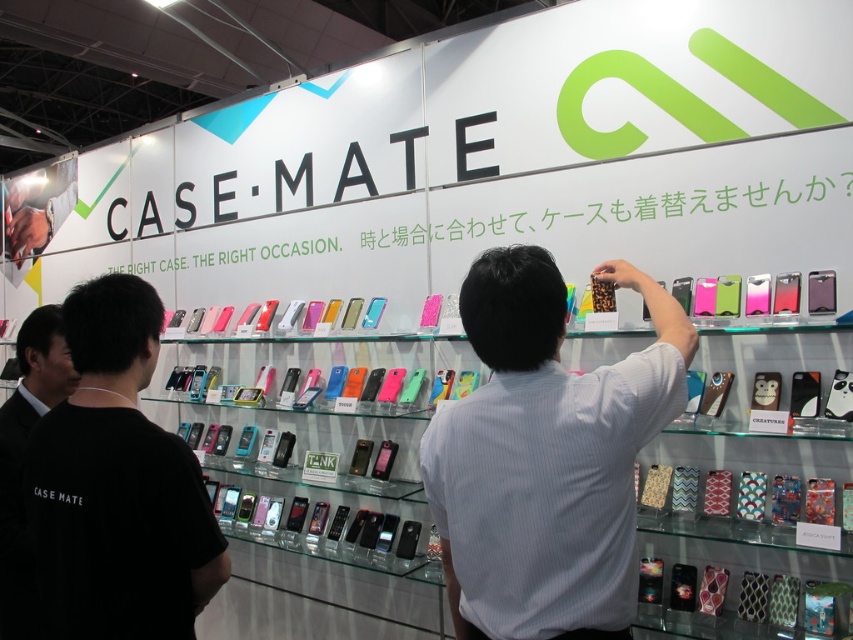
Question: Is leopard print case at upper center positioned in front of black shirt at left?

Choices:
 (A) yes
 (B) no

Answer: (A)

Question: Is black t-shirt at left smaller than black shirt at left?

Choices:
 (A) yes
 (B) no

Answer: (A)

Question: Which point is closer to the camera taking this photo?

Choices:
 (A) (148, 420)
 (B) (647, 371)
 (C) (3, 438)

Answer: (B)

Question: Among these points, which one is nearest to the camera?

Choices:
 (A) (22, 628)
 (B) (105, 344)

Answer: (B)

Question: Can you confirm if black t-shirt at left is positioned above black shirt at left?

Choices:
 (A) yes
 (B) no

Answer: (A)

Question: Among these objects, which one is nearest to the camera?

Choices:
 (A) leopard print case at upper center
 (B) black shirt at left
 (C) black t-shirt at left

Answer: (A)